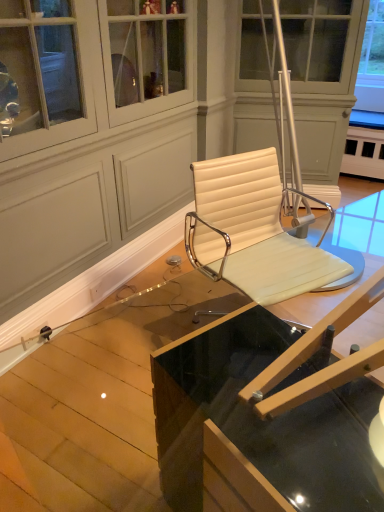
Question: Does transparent glass table at center, the 2th table when ordered from front to back, have a greater height compared to clear glass table at center, the second table viewed from the back?

Choices:
 (A) no
 (B) yes

Answer: (A)

Question: Can you confirm if transparent glass table at center, the 2th table when ordered from front to back, is bigger than clear glass table at center, the 1th table viewed from the front?

Choices:
 (A) no
 (B) yes

Answer: (A)

Question: Is transparent glass table at center, which is counted as the first table, starting from the back, with clear glass table at center, the second table viewed from the back?

Choices:
 (A) no
 (B) yes

Answer: (A)

Question: Is transparent glass table at center, the 2th table when ordered from front to back, positioned behind clear glass table at center, the second table viewed from the back?

Choices:
 (A) yes
 (B) no

Answer: (A)

Question: Considering the relative sizes of transparent glass table at center, which is counted as the first table, starting from the back, and clear glass table at center, the 1th table viewed from the front, in the image provided, is transparent glass table at center, which is counted as the first table, starting from the back, wider than clear glass table at center, the 1th table viewed from the front,?

Choices:
 (A) yes
 (B) no

Answer: (A)

Question: Considering the relative sizes of transparent glass table at center, which is counted as the first table, starting from the back, and clear glass table at center, the second table viewed from the back, in the image provided, is transparent glass table at center, which is counted as the first table, starting from the back, smaller than clear glass table at center, the second table viewed from the back,?

Choices:
 (A) no
 (B) yes

Answer: (B)

Question: Is there a large distance between white leather chair at center and transparent glass table at center, the 2th table when ordered from front to back?

Choices:
 (A) yes
 (B) no

Answer: (B)

Question: Is white leather chair at center placed right next to transparent glass table at center, the 2th table when ordered from front to back?

Choices:
 (A) no
 (B) yes

Answer: (A)

Question: Is transparent glass table at center, the 2th table when ordered from front to back, surrounded by white leather chair at center?

Choices:
 (A) yes
 (B) no

Answer: (B)

Question: From a real-world perspective, is white leather chair at center beneath transparent glass table at center, the 2th table when ordered from front to back?

Choices:
 (A) no
 (B) yes

Answer: (A)

Question: Considering the relative positions of white leather chair at center and transparent glass table at center, which is counted as the first table, starting from the back, in the image provided, is white leather chair at center behind transparent glass table at center, which is counted as the first table, starting from the back,?

Choices:
 (A) yes
 (B) no

Answer: (A)

Question: Does white leather chair at center have a greater height compared to transparent glass table at center, the 2th table when ordered from front to back?

Choices:
 (A) yes
 (B) no

Answer: (A)

Question: Is white leather chair at center to the right of clear glass table at center, the second table viewed from the back, from the viewer's perspective?

Choices:
 (A) no
 (B) yes

Answer: (A)